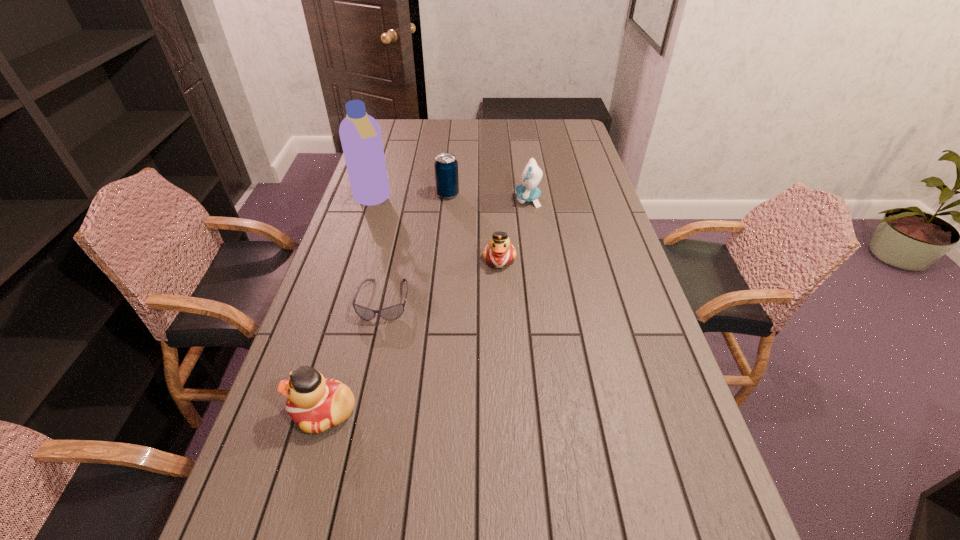
Find the location of a particular element. This screenshot has height=540, width=960. free space at the near edge is located at coordinates (505, 504).

I want to click on blank space at the left edge of the desktop, so click(356, 234).

Image resolution: width=960 pixels, height=540 pixels. In the image, there is a desktop. What are the coordinates of `free space at the right edge` in the screenshot? It's located at (594, 281).

Where is `free space at the far left corner`? This screenshot has width=960, height=540. free space at the far left corner is located at coordinates (416, 122).

You are a GUI agent. You are given a task and a screenshot of the screen. Output one action in this format:
    pyautogui.click(x=<x>, y=<y>)
    Task: Click on the vacant space at the far right corner
    The width and height of the screenshot is (960, 540).
    Given the screenshot: What is the action you would take?
    pyautogui.click(x=556, y=141)

Image resolution: width=960 pixels, height=540 pixels. In order to click on vacant space that's between the farther duck and the tallest object in this screenshot , I will do `click(436, 230)`.

Where is `free space that is in between the nearest object and the shortest object`? Image resolution: width=960 pixels, height=540 pixels. free space that is in between the nearest object and the shortest object is located at coordinates (354, 356).

Locate an element on the screen. The width and height of the screenshot is (960, 540). free area in between the soda can and the left duck is located at coordinates (386, 303).

You are a GUI agent. You are given a task and a screenshot of the screen. Output one action in this format:
    pyautogui.click(x=<x>, y=<y>)
    Task: Click on the blank region between the rightmost object and the third object from right to left
    This screenshot has height=540, width=960.
    Given the screenshot: What is the action you would take?
    pyautogui.click(x=488, y=197)

The image size is (960, 540). I want to click on free spot between the shampoo and the rightmost object, so click(x=450, y=200).